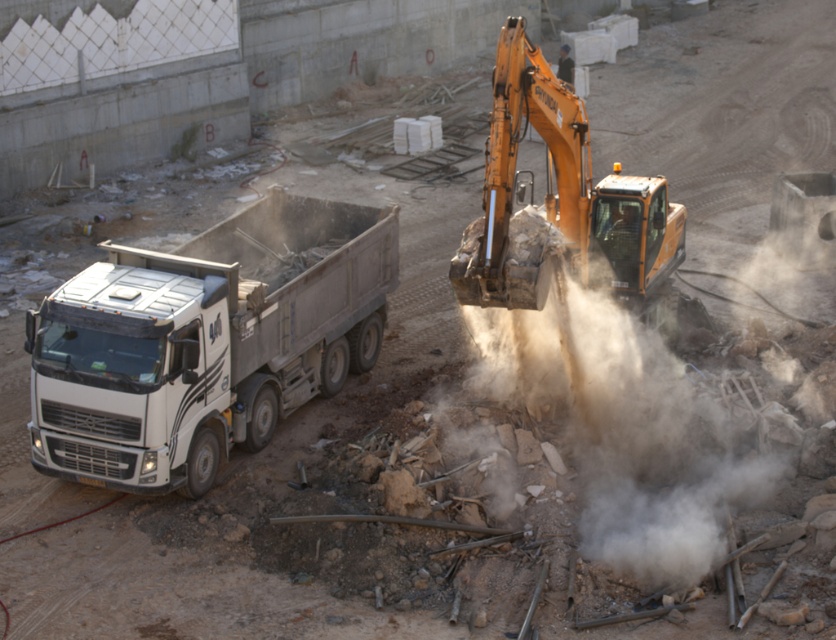
You are a construction worker standing at the point labeled as point [206,340]. What object are you standing on?

You are standing on the white metallic truck at left.

You are a construction worker standing at the point labeled point (650, 451). What do you see directly in front of you?

At point (650, 451) lies brown dusty debris at center.

You are a construction worker standing at the center of the site. You need to move a heavy object from the white metallic truck at left to the excavator to the right. Which direction should you move the object to ensure it reaches the excavator?

The white metallic truck at left is located at point (206,340). Since the excavator is to the right of the truck, you should move the object towards the right direction to reach the excavator.